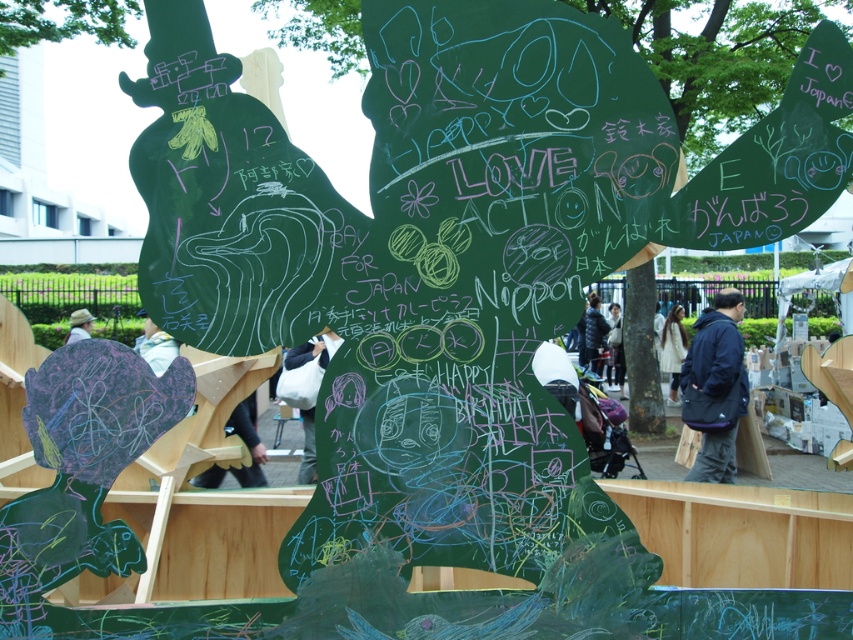
Is dark blue fabric bag at right to the left of white fabric bag at center from the viewer's perspective?

Indeed, dark blue fabric bag at right is positioned on the left side of white fabric bag at center.

Looking at this image, is dark blue fabric bag at right wider than white fabric bag at center?

Indeed, dark blue fabric bag at right has a greater width compared to white fabric bag at center.

I want to click on dark blue fabric bag at right, so click(x=715, y=387).

How far apart are white fabric at center and dark blue jacket at center?

3.65 feet

Does white fabric at center appear under dark blue jacket at center?

Indeed, white fabric at center is positioned under dark blue jacket at center.

Describe the element at coordinates (672, 349) in the screenshot. I see `white fabric at center` at that location.

Find the location of a particular element. The width and height of the screenshot is (853, 640). white fabric at center is located at coordinates (672, 349).

Who is taller, dark blue jacket at center or light brown straw hat at lower left?

Standing taller between the two is dark blue jacket at center.

Between dark blue jacket at center and light brown straw hat at lower left, which one appears on the right side from the viewer's perspective?

dark blue jacket at center

Between point (596, 342) and point (76, 310), which one is positioned in front?

Point (596, 342) is more forward.

Locate an element on the screen. This screenshot has width=853, height=640. dark blue jacket at center is located at coordinates (595, 332).